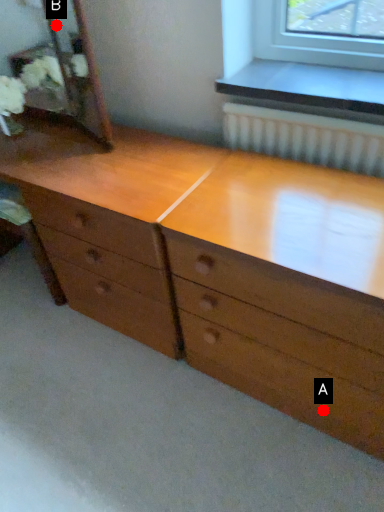
Question: Two points are circled on the image, labeled by A and B beside each circle. Which point is farther from the camera taking this photo?

Choices:
 (A) A is further
 (B) B is further

Answer: (B)